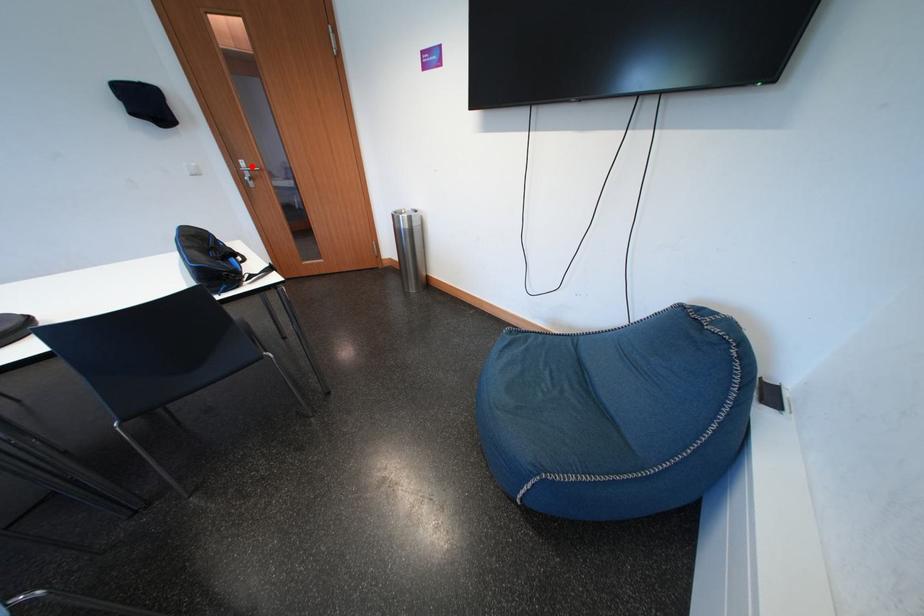
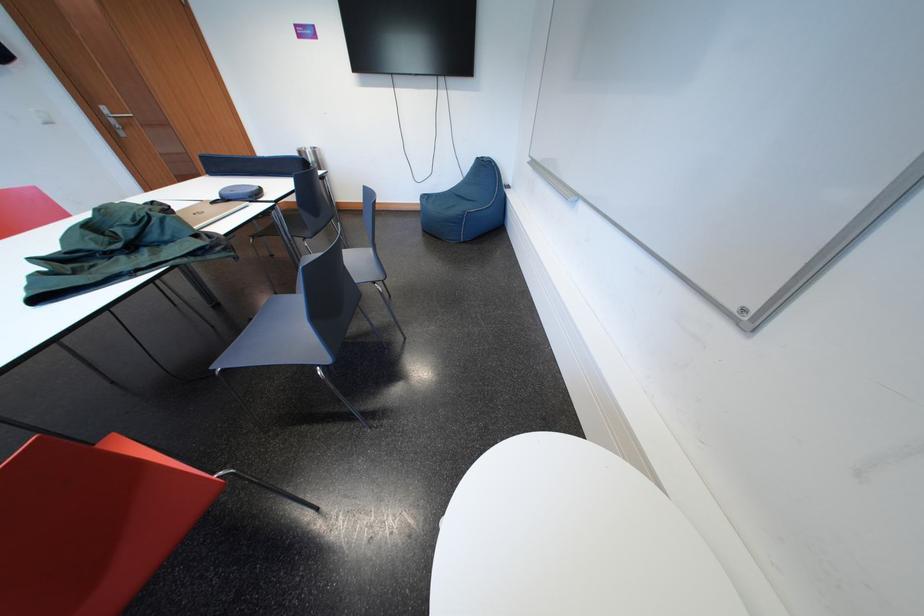
Find the pixel in the second image that matches the highlighted location in the first image.

(113, 113)